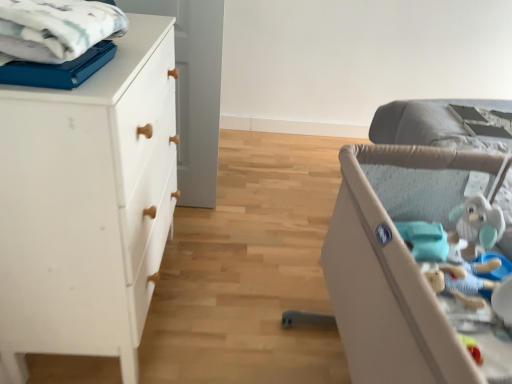
Question: Is white cotton blanket at upper left at the right side of white matte chest of drawers at left?

Choices:
 (A) yes
 (B) no

Answer: (A)

Question: Is white cotton blanket at upper left in contact with white matte chest of drawers at left?

Choices:
 (A) no
 (B) yes

Answer: (A)

Question: From the image's perspective, would you say white cotton blanket at upper left is positioned over white matte chest of drawers at left?

Choices:
 (A) no
 (B) yes

Answer: (B)

Question: From a real-world perspective, is white cotton blanket at upper left physically below white matte chest of drawers at left?

Choices:
 (A) no
 (B) yes

Answer: (A)

Question: Is white cotton blanket at upper left not close to white matte chest of drawers at left?

Choices:
 (A) no
 (B) yes

Answer: (A)

Question: From the image's perspective, relative to beige fabric infant bed at right, is white cotton blanket at upper left above or below?

Choices:
 (A) below
 (B) above

Answer: (B)

Question: Is white cotton blanket at upper left spatially inside beige fabric infant bed at right, or outside of it?

Choices:
 (A) inside
 (B) outside

Answer: (B)

Question: Is point (109, 11) positioned closer to the camera than point (422, 331)?

Choices:
 (A) closer
 (B) farther

Answer: (B)

Question: Looking at their shapes, would you say white cotton blanket at upper left is wider or thinner than beige fabric infant bed at right?

Choices:
 (A) wide
 (B) thin

Answer: (B)

Question: From a real-world perspective, is beige fabric infant bed at right physically located above or below white matte chest of drawers at left?

Choices:
 (A) above
 (B) below

Answer: (B)

Question: Looking at the image, does beige fabric infant bed at right seem bigger or smaller compared to white matte chest of drawers at left?

Choices:
 (A) big
 (B) small

Answer: (A)

Question: Is beige fabric infant bed at right taller or shorter than white matte chest of drawers at left?

Choices:
 (A) tall
 (B) short

Answer: (B)

Question: Looking at their shapes, would you say beige fabric infant bed at right is wider or thinner than white matte chest of drawers at left?

Choices:
 (A) thin
 (B) wide

Answer: (B)

Question: Is white cotton blanket at upper left inside the boundaries of white matte chest of drawers at left, or outside?

Choices:
 (A) inside
 (B) outside

Answer: (B)

Question: In terms of width, does white cotton blanket at upper left look wider or thinner when compared to white matte chest of drawers at left?

Choices:
 (A) thin
 (B) wide

Answer: (A)